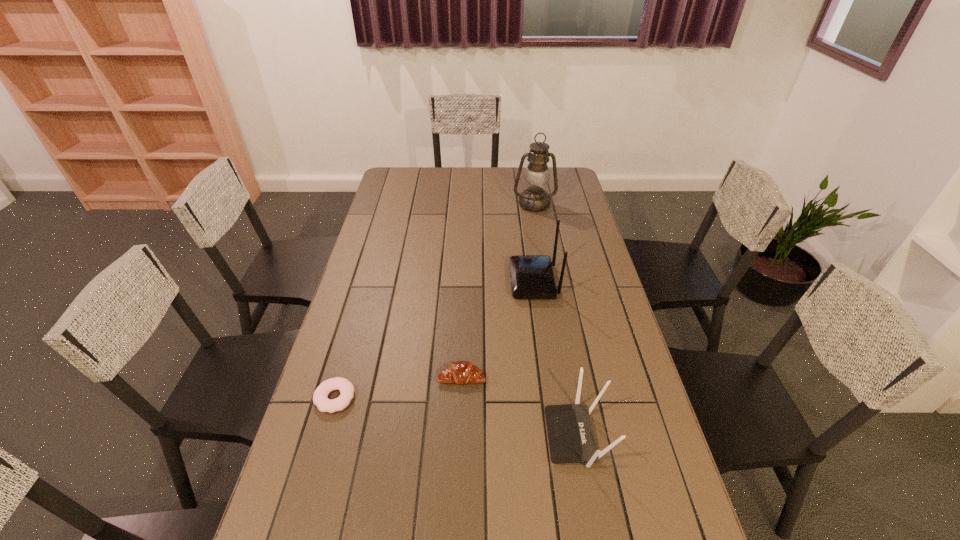
The height and width of the screenshot is (540, 960). I want to click on free space between the farther router and the doughnut, so click(x=434, y=340).

Locate an element on the screen. This screenshot has height=540, width=960. vacant area that lies between the farther router and the fourth tallest object is located at coordinates (497, 329).

At what (x,y) coordinates should I click in order to perform the action: click on unoccupied position between the shortest object and the fourth shortest object. Please return your answer as a coordinate pair (x, y). Looking at the image, I should click on (434, 340).

At what (x,y) coordinates should I click in order to perform the action: click on vacant region between the nearer router and the taller router. Please return your answer as a coordinate pair (x, y). Looking at the image, I should click on (556, 359).

This screenshot has width=960, height=540. In order to click on free space between the shortest object and the third shortest object in this screenshot , I will do `click(456, 417)`.

At what (x,y) coordinates should I click in order to perform the action: click on free area in between the taller router and the shorter router. Please return your answer as a coordinate pair (x, y). The image size is (960, 540). Looking at the image, I should click on (556, 359).

I want to click on object that ranks as the third closest to the tallest object, so click(x=571, y=440).

The width and height of the screenshot is (960, 540). I want to click on object that ranks as the fourth closest to the oil lamp, so click(346, 388).

Where is `vacant space that satisfies the following two spatial constraints: 1. on the back side of the shortest object; 2. on the right side of the crescent roll`? vacant space that satisfies the following two spatial constraints: 1. on the back side of the shortest object; 2. on the right side of the crescent roll is located at coordinates (341, 377).

At what (x,y) coordinates should I click in order to perform the action: click on vacant space that satisfies the following two spatial constraints: 1. on the front-facing side of the second tallest object; 2. on the front side of the doughnut. Please return your answer as a coordinate pair (x, y). Looking at the image, I should click on (550, 398).